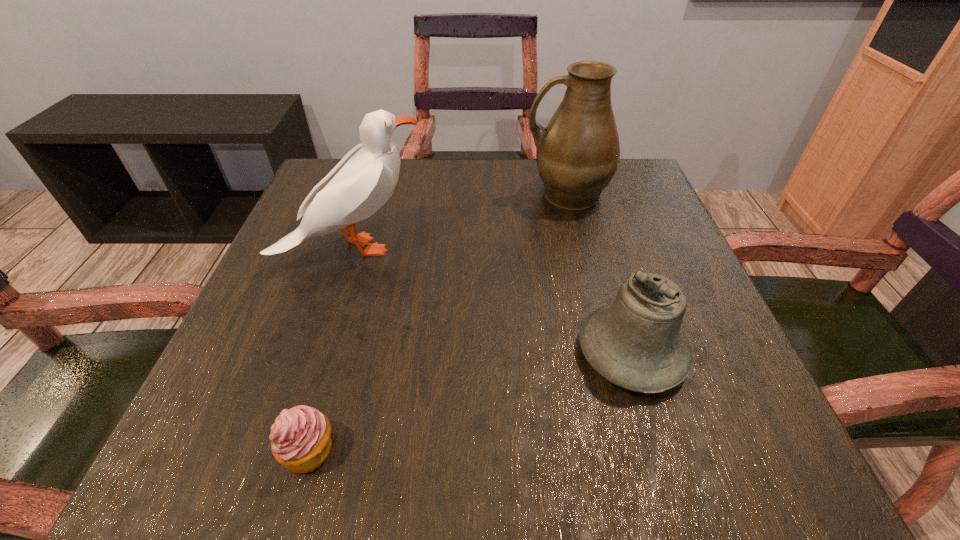
I want to click on free space at the far edge of the desktop, so click(x=546, y=201).

In the image, there is a desktop. Where is `vacant space at the near edge`? The image size is (960, 540). vacant space at the near edge is located at coordinates (528, 423).

Image resolution: width=960 pixels, height=540 pixels. Identify the location of vacant space at the left edge of the desktop. (249, 377).

Where is `vacant space at the right edge of the desktop`? The width and height of the screenshot is (960, 540). vacant space at the right edge of the desktop is located at coordinates (705, 382).

This screenshot has height=540, width=960. In the image, there is a desktop. Find the location of `vacant space at the far left corner`. vacant space at the far left corner is located at coordinates (327, 170).

Locate an element on the screen. The width and height of the screenshot is (960, 540). free region at the near right corner of the desktop is located at coordinates (740, 448).

Where is `vacant area that lies between the cupcake and the second farthest object`? This screenshot has height=540, width=960. vacant area that lies between the cupcake and the second farthest object is located at coordinates (331, 349).

You are a GUI agent. You are given a task and a screenshot of the screen. Output one action in this format:
    pyautogui.click(x=<x>, y=<y>)
    Task: Click on the free point between the cupcake and the pitcher
    
    Given the screenshot: What is the action you would take?
    pyautogui.click(x=438, y=322)

At what (x,y) coordinates should I click in order to perform the action: click on unoccupied position between the pitcher and the nearest object. Please return your answer as a coordinate pair (x, y). The width and height of the screenshot is (960, 540). Looking at the image, I should click on (438, 322).

What are the coordinates of `vacant space that's between the second shortest object and the shortest object` in the screenshot? It's located at (470, 401).